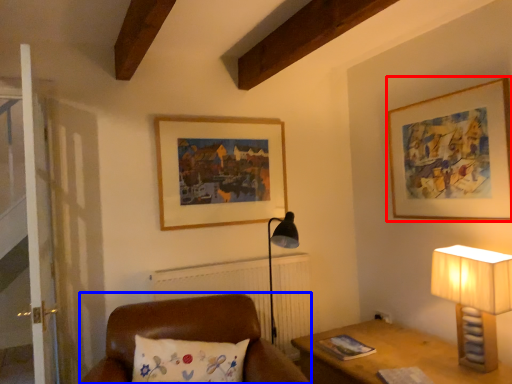
Question: Which object is closer to the camera taking this photo, picture frame (highlighted by a red box) or furniture (highlighted by a blue box)?

Choices:
 (A) picture frame
 (B) furniture

Answer: (B)